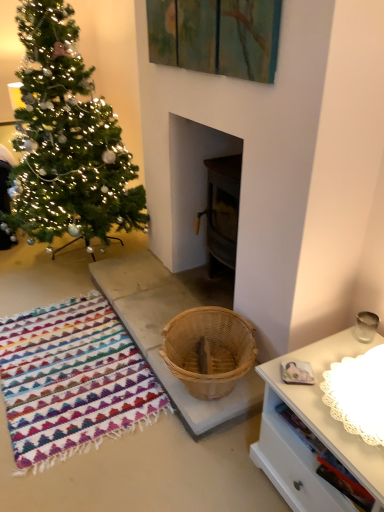
Question: From the image's perspective, does green matte christmas tree at left appear lower than multicolored woven rug at lower left?

Choices:
 (A) yes
 (B) no

Answer: (B)

Question: Considering the relative positions of green matte christmas tree at left and multicolored woven rug at lower left in the image provided, is green matte christmas tree at left to the right of multicolored woven rug at lower left from the viewer's perspective?

Choices:
 (A) yes
 (B) no

Answer: (B)

Question: Is green matte christmas tree at left positioned in front of multicolored woven rug at lower left?

Choices:
 (A) no
 (B) yes

Answer: (A)

Question: Is multicolored woven rug at lower left located within green matte christmas tree at left?

Choices:
 (A) yes
 (B) no

Answer: (B)

Question: Can you confirm if green matte christmas tree at left is thinner than multicolored woven rug at lower left?

Choices:
 (A) no
 (B) yes

Answer: (A)

Question: From the image's perspective, is green matte christmas tree at left located above multicolored woven rug at lower left?

Choices:
 (A) yes
 (B) no

Answer: (A)

Question: Considering the relative sizes of natural wood basket at center and multicolored woven rug at lower left in the image provided, is natural wood basket at center taller than multicolored woven rug at lower left?

Choices:
 (A) yes
 (B) no

Answer: (A)

Question: From the image's perspective, is natural wood basket at center located beneath multicolored woven rug at lower left?

Choices:
 (A) no
 (B) yes

Answer: (A)

Question: Is the depth of natural wood basket at center greater than that of multicolored woven rug at lower left?

Choices:
 (A) yes
 (B) no

Answer: (A)

Question: Does natural wood basket at center have a lesser width compared to multicolored woven rug at lower left?

Choices:
 (A) no
 (B) yes

Answer: (B)

Question: From a real-world perspective, is natural wood basket at center on top of multicolored woven rug at lower left?

Choices:
 (A) yes
 (B) no

Answer: (A)

Question: Considering the relative sizes of natural wood basket at center and multicolored woven rug at lower left in the image provided, is natural wood basket at center wider than multicolored woven rug at lower left?

Choices:
 (A) no
 (B) yes

Answer: (A)

Question: Does natural wood basket at center have a lesser width compared to green matte christmas tree at left?

Choices:
 (A) yes
 (B) no

Answer: (A)